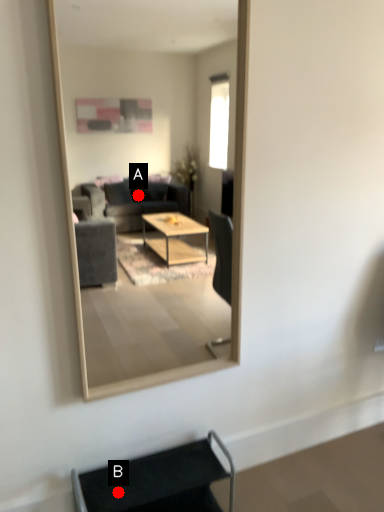
Question: Two points are circled on the image, labeled by A and B beside each circle. Which point appears farthest from the camera in this image?

Choices:
 (A) A is further
 (B) B is further

Answer: (A)